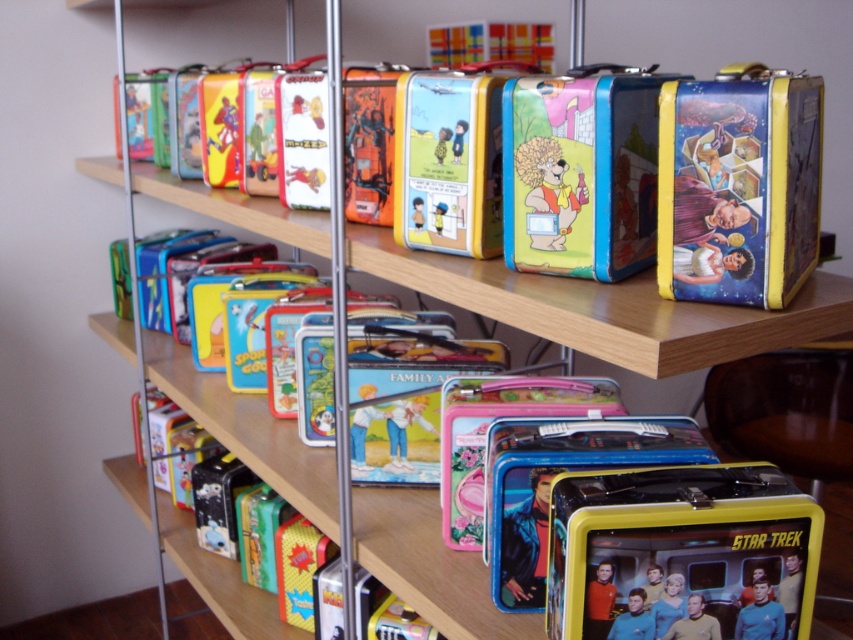
You are standing in front of the vintage lunchbox display. You need to locate the metallic yellow lunchbox at lower right. What are the coordinates of its position?

The metallic yellow lunchbox at lower right is located at coordinates point [680,548].